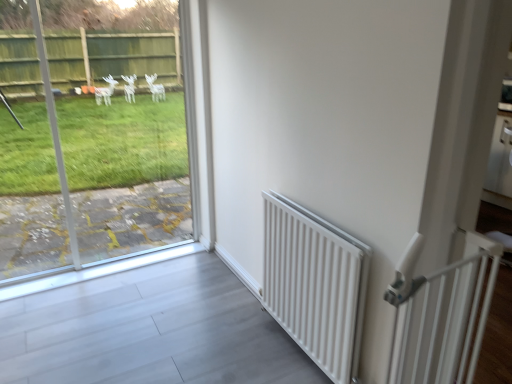
Where is `free space in front of transparent glass window at left`? The width and height of the screenshot is (512, 384). free space in front of transparent glass window at left is located at coordinates (106, 338).